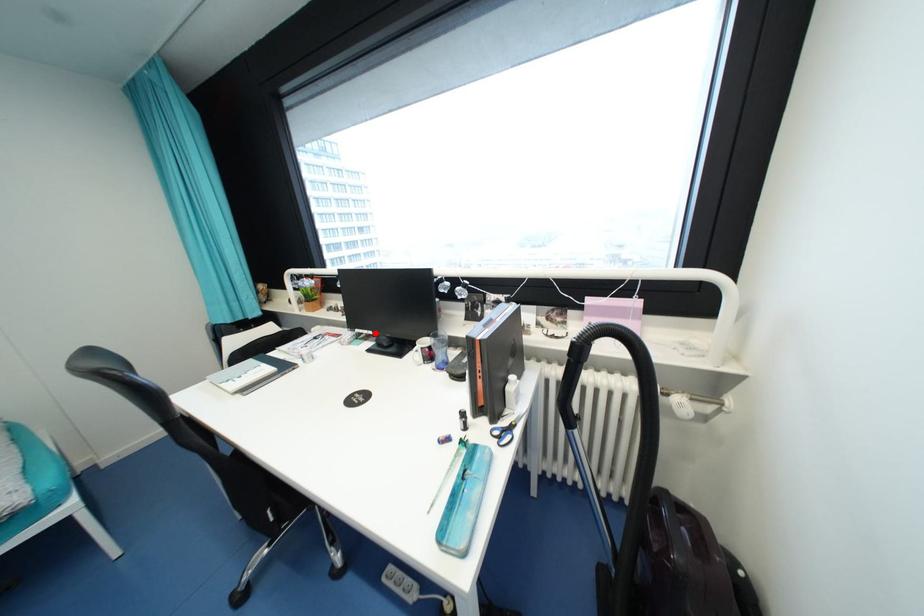
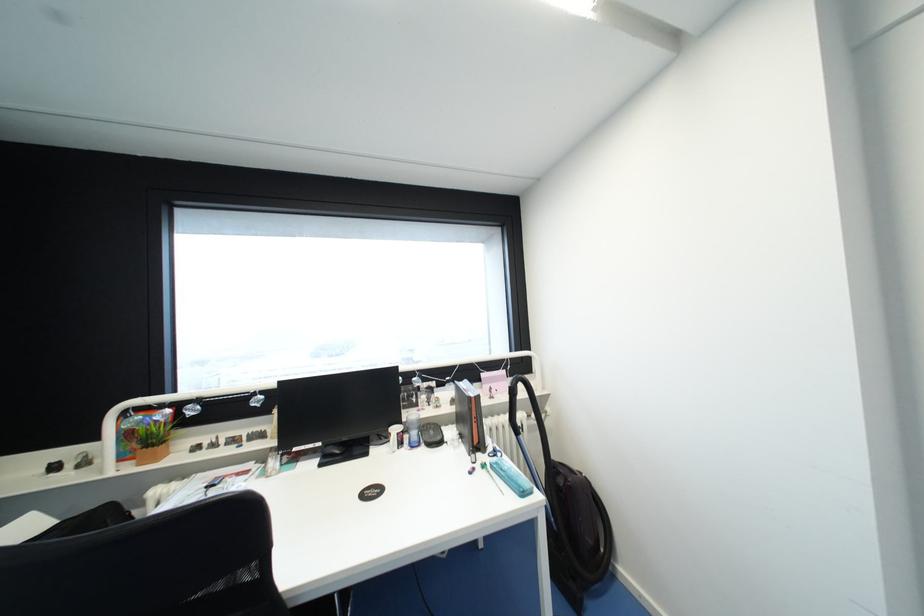
Locate, in the second image, the point that corresponds to the highlighted location in the first image.

(323, 445)